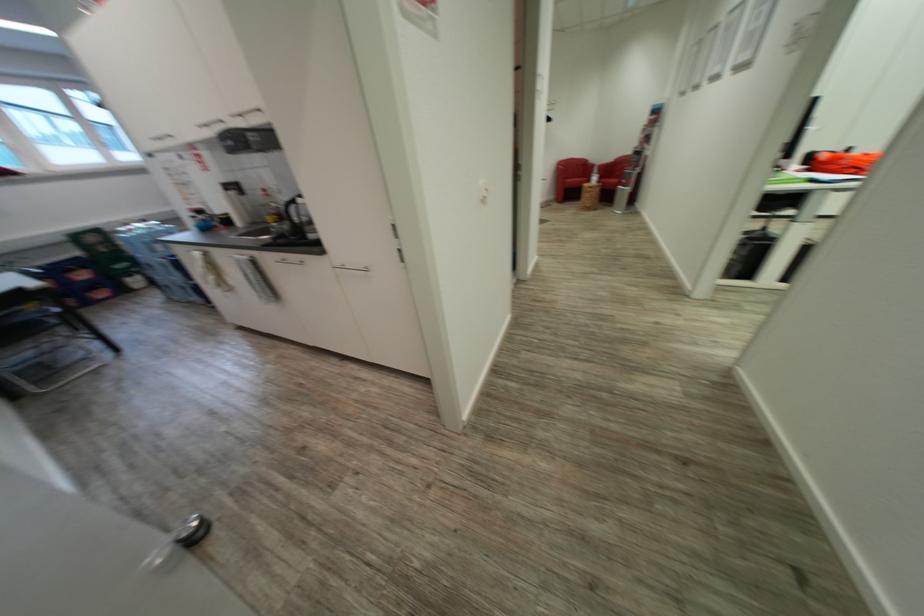
You are a GUI agent. You are given a task and a screenshot of the screen. Output one action in this format:
    pyautogui.click(x=<x>, y=<y>)
    Task: Click on the chrome door stop
    
    Given the screenshot: What is the action you would take?
    pyautogui.click(x=191, y=531)